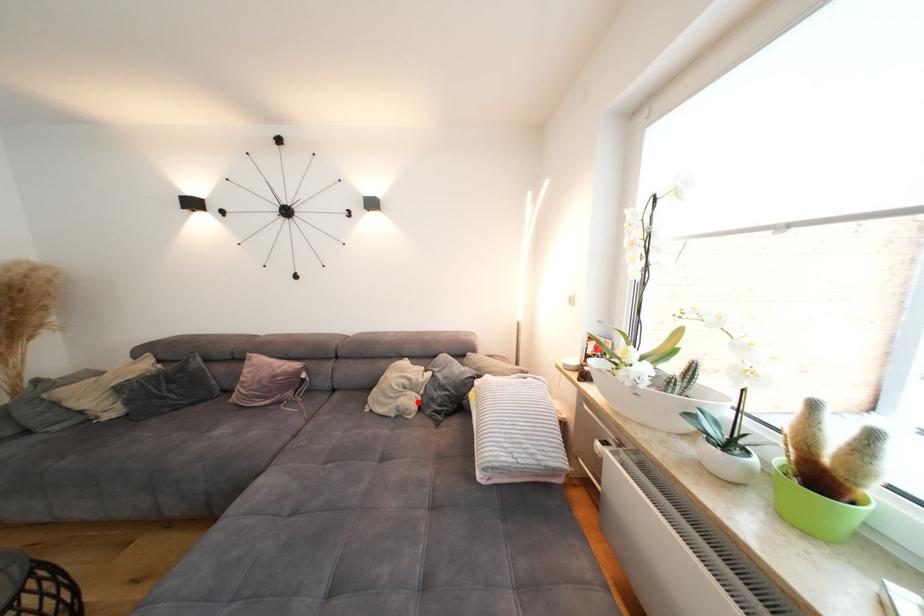
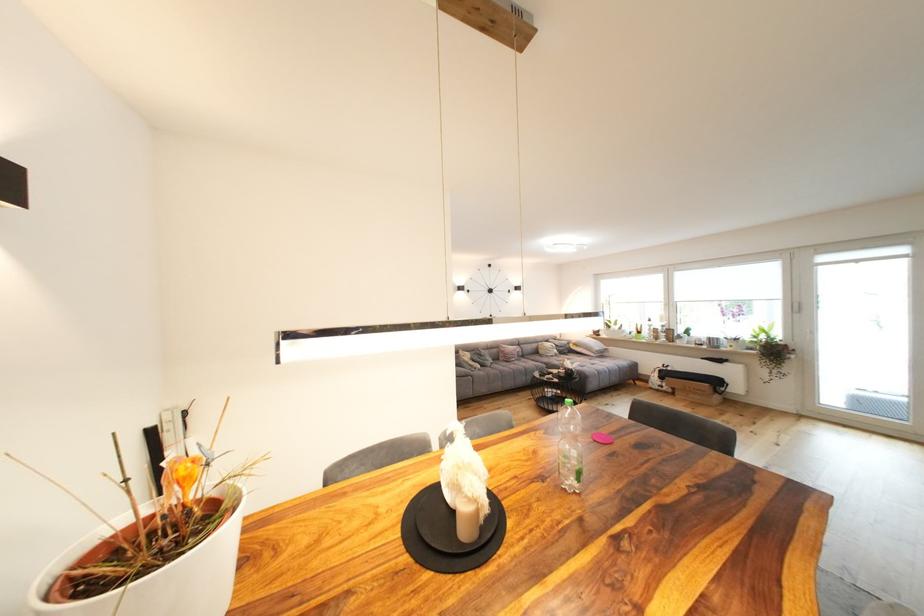
Where in the second image is the point corresponding to the highlighted location from the first image?

(563, 353)